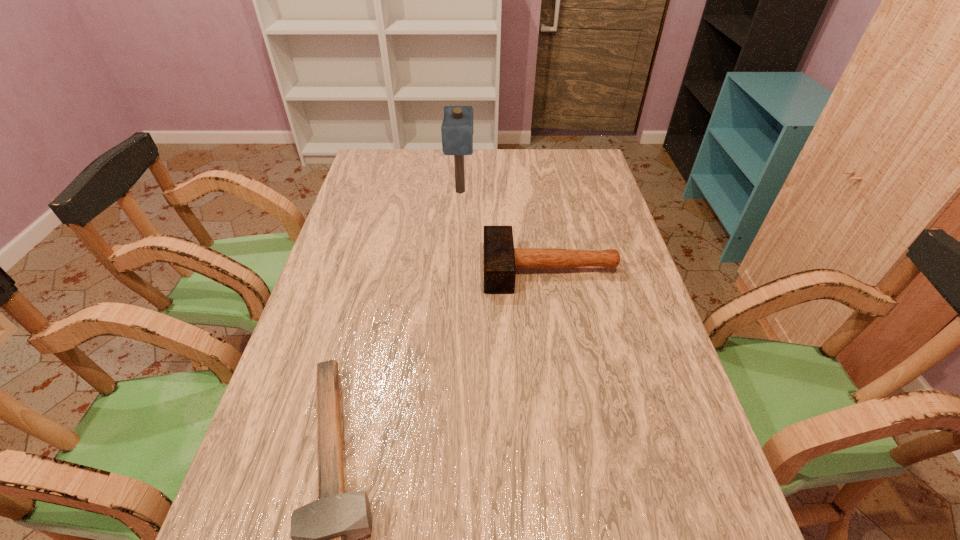
The image size is (960, 540). What are the coordinates of `vacant region at the far edge of the desktop` in the screenshot? It's located at (475, 170).

Locate an element on the screen. The width and height of the screenshot is (960, 540). vacant space at the left edge is located at coordinates (303, 403).

At what (x,y) coordinates should I click in order to perform the action: click on vacant space at the right edge of the desktop. Please return your answer as a coordinate pair (x, y). The height and width of the screenshot is (540, 960). Looking at the image, I should click on (630, 413).

The image size is (960, 540). What are the coordinates of `free space at the far left corner of the desktop` in the screenshot? It's located at (366, 177).

This screenshot has width=960, height=540. I want to click on free space at the far right corner of the desktop, so click(569, 172).

Identify which object is located as the second nearest to the nearest object. Please provide its 2D coordinates. Your answer should be formatted as a tuple, i.e. [(x, y)], where the tuple contains the x and y coordinates of a point satisfying the conditions above.

[(457, 127)]

Where is `the second closest object to the second object from left to right`? The height and width of the screenshot is (540, 960). the second closest object to the second object from left to right is located at coordinates (324, 534).

This screenshot has height=540, width=960. I want to click on the second closest mallet to the nearest object, so click(457, 127).

Point out which mallet is positioned as the second nearest to the second shortest mallet. Please provide its 2D coordinates. Your answer should be formatted as a tuple, i.e. [(x, y)], where the tuple contains the x and y coordinates of a point satisfying the conditions above.

[(324, 534)]